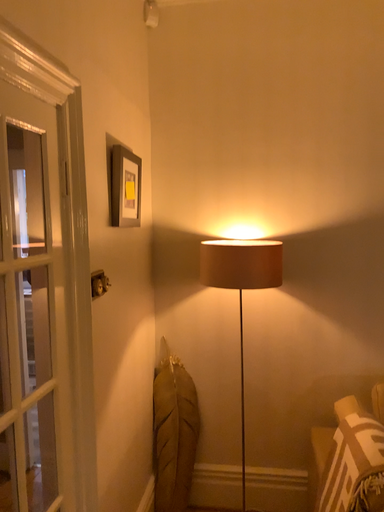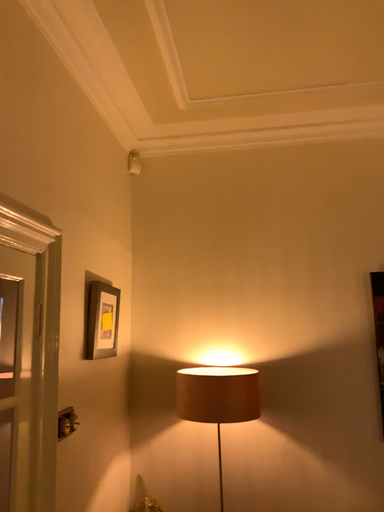
Question: Which way did the camera rotate in the video?

Choices:
 (A) rotated upward
 (B) rotated downward

Answer: (A)